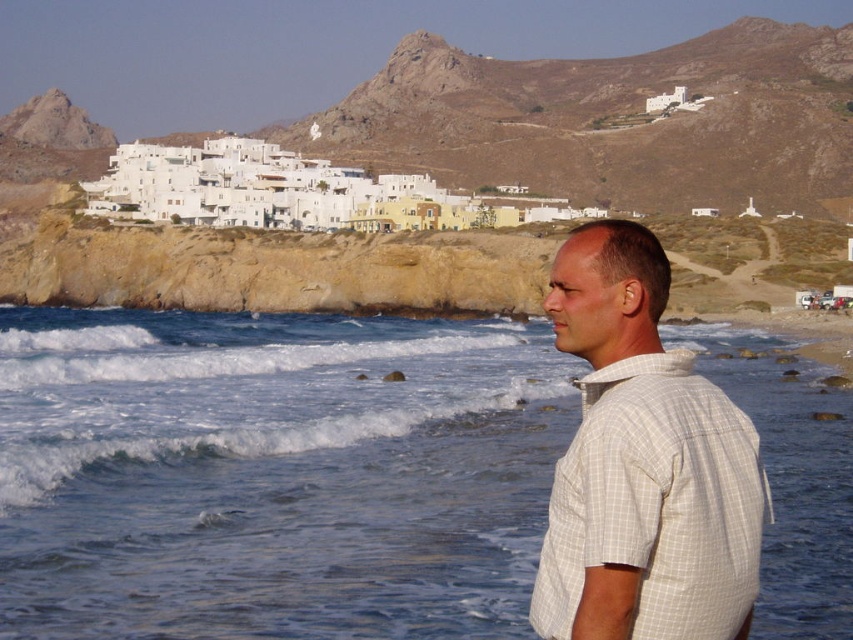
You are a photographer trying to capture a wide shot of the coastal scene. You notice the blue water at lower left and the white checkered shirt at right in your frame. Based on their sizes in the image, which object would likely occupy more of the horizontal space in your photo?

The blue water at lower left might be wider than white checkered shirt at right, so it would likely occupy more horizontal space in the photo.

You are a photographer planning to take a wide shot of the coastal scene. You want to ensure that both the blue water at lower left and the white checkered shirt at right are clearly visible. Based on their sizes in the image, which object should you focus on to ensure both are in frame?

The blue water at lower left is larger in size than the white checkered shirt at right, so focusing on the larger blue water at lower left will help ensure both objects remain in frame.

Based on the photo, you are a photographer trying to capture the man in the white checkered shirt at right while ensuring the blue water at lower left is visible in the frame. Based on their heights, which object should be placed closer to the camera to achieve this composition?

The blue water at lower left has a lesser height compared to the white checkered shirt at right. To include both in the frame with the desired composition, position the blue water at lower left closer to the camera since it is shorter, allowing the taller white checkered shirt at right to be visible without blocking the water.